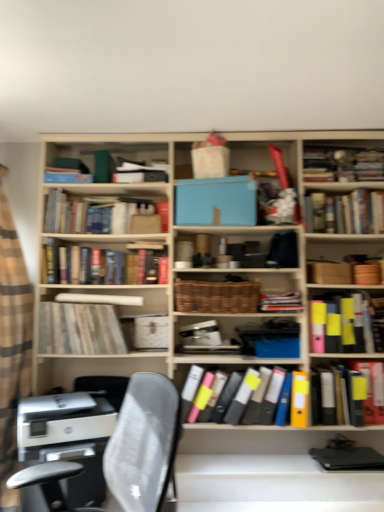
Question: Can you confirm if hardcover books at upper left, the eighth book in the bottom-to-top sequence, is positioned to the left of woven brown basket at center?

Choices:
 (A) yes
 (B) no

Answer: (A)

Question: Is the depth of hardcover books at upper left, the eighth book in the bottom-to-top sequence, less than that of woven brown basket at center?

Choices:
 (A) no
 (B) yes

Answer: (A)

Question: Is hardcover books at upper left, the eighth book in the bottom-to-top sequence, bigger than woven brown basket at center?

Choices:
 (A) no
 (B) yes

Answer: (B)

Question: Considering the relative positions of hardcover books at upper left, placed as the 1th book when sorted from top to bottom, and woven brown basket at center in the image provided, is hardcover books at upper left, placed as the 1th book when sorted from top to bottom, to the right of woven brown basket at center from the viewer's perspective?

Choices:
 (A) yes
 (B) no

Answer: (B)

Question: Does hardcover books at upper left, placed as the 1th book when sorted from top to bottom, have a smaller size compared to woven brown basket at center?

Choices:
 (A) no
 (B) yes

Answer: (A)

Question: Considering the relative positions of woven brown basket at center and hardcover books at upper left, the eighth book in the bottom-to-top sequence, in the image provided, is woven brown basket at center to the left or to the right of hardcover books at upper left, the eighth book in the bottom-to-top sequence,?

Choices:
 (A) left
 (B) right

Answer: (B)

Question: Based on their sizes in the image, would you say woven brown basket at center is bigger or smaller than hardcover books at upper left, the eighth book in the bottom-to-top sequence?

Choices:
 (A) big
 (B) small

Answer: (B)

Question: From the image's perspective, relative to hardcover books at upper left, the eighth book in the bottom-to-top sequence, is woven brown basket at center above or below?

Choices:
 (A) below
 (B) above

Answer: (A)

Question: Is woven brown basket at center wider or thinner than hardcover books at upper left, the eighth book in the bottom-to-top sequence?

Choices:
 (A) thin
 (B) wide

Answer: (B)

Question: Would you say multicolored file folders at center, the eighth book in the top-to-bottom sequence, is inside or outside woven brown basket at center?

Choices:
 (A) outside
 (B) inside

Answer: (A)

Question: Looking at their shapes, would you say multicolored file folders at center, positioned as the first book in bottom-to-top order, is wider or thinner than woven brown basket at center?

Choices:
 (A) wide
 (B) thin

Answer: (A)

Question: From a real-world perspective, relative to woven brown basket at center, is multicolored file folders at center, the eighth book in the top-to-bottom sequence, vertically above or below?

Choices:
 (A) above
 (B) below

Answer: (B)

Question: From the image's perspective, is multicolored file folders at center, the eighth book in the top-to-bottom sequence, positioned above or below woven brown basket at center?

Choices:
 (A) above
 (B) below

Answer: (B)

Question: From a real-world perspective, is blue matte book at center positioned above or below hardcover books at center, marked as the 6th book in a bottom-to-top arrangement?

Choices:
 (A) below
 (B) above

Answer: (B)

Question: Visually, is blue matte book at center positioned to the left or to the right of hardcover books at center, which is the 3th book from top to bottom?

Choices:
 (A) left
 (B) right

Answer: (B)